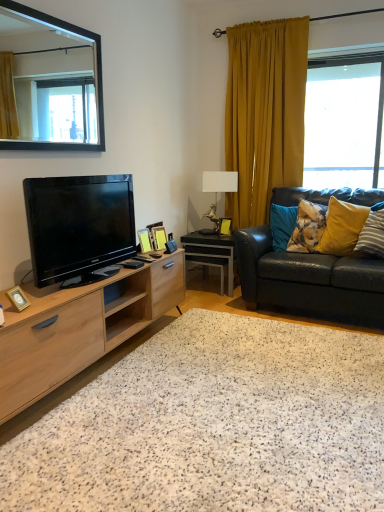
Question: From a real-world perspective, is natural wood cabinet at left below gold metallic photo frame at lower left, which appears as the first picture frame when ordered from the bottom?

Choices:
 (A) yes
 (B) no

Answer: (A)

Question: Is natural wood cabinet at left taller than gold metallic photo frame at lower left, the first picture frame when ordered from left to right?

Choices:
 (A) yes
 (B) no

Answer: (A)

Question: Is the depth of natural wood cabinet at left less than that of gold metallic photo frame at lower left, which ranks as the fourth picture frame in back-to-front order?

Choices:
 (A) yes
 (B) no

Answer: (A)

Question: Is natural wood cabinet at left bigger than gold metallic photo frame at lower left, which appears as the first picture frame when ordered from the bottom?

Choices:
 (A) yes
 (B) no

Answer: (A)

Question: Is natural wood cabinet at left positioned beyond the bounds of gold metallic photo frame at lower left, which is the fourth picture frame in top-to-bottom order?

Choices:
 (A) no
 (B) yes

Answer: (B)

Question: Is wooden picture frame at center, the third picture frame from the left, in front of or behind wooden picture frame at center, the 3th picture frame viewed from the back, in the image?

Choices:
 (A) front
 (B) behind

Answer: (B)

Question: In terms of size, does wooden picture frame at center, the third picture frame from the left, appear bigger or smaller than wooden picture frame at center, which is counted as the 3th picture frame, starting from the right?

Choices:
 (A) big
 (B) small

Answer: (A)

Question: Do you think wooden picture frame at center, arranged as the second picture frame when viewed from the right, is within wooden picture frame at center, the 2th picture frame positioned from the bottom, or outside of it?

Choices:
 (A) inside
 (B) outside

Answer: (B)

Question: In terms of height, does wooden picture frame at center, arranged as the second picture frame when viewed from the right, look taller or shorter compared to wooden picture frame at center, the 3th picture frame viewed from the back?

Choices:
 (A) short
 (B) tall

Answer: (B)

Question: Considering their positions, is gold metallic photo frame at lower left, the 4th picture frame when ordered from right to left, located in front of or behind yellow fabric pillow at right, the 1th pillow positioned from the right?

Choices:
 (A) behind
 (B) front

Answer: (B)

Question: Considering the positions of gold metallic photo frame at lower left, which ranks as the fourth picture frame in back-to-front order, and yellow fabric pillow at right, the 1th pillow positioned from the right, in the image, is gold metallic photo frame at lower left, which ranks as the fourth picture frame in back-to-front order, taller or shorter than yellow fabric pillow at right, the 1th pillow positioned from the right,?

Choices:
 (A) short
 (B) tall

Answer: (A)

Question: Is point pos(16,286) closer or farther from the camera than point pos(377,217)?

Choices:
 (A) farther
 (B) closer

Answer: (B)

Question: In terms of size, does gold metallic photo frame at lower left, which is the fourth picture frame in top-to-bottom order, appear bigger or smaller than yellow fabric pillow at right, which is the third pillow from left to right?

Choices:
 (A) big
 (B) small

Answer: (B)

Question: Considering the positions of black glossy tv at left and metallic gold lamp at center in the image, is black glossy tv at left wider or thinner than metallic gold lamp at center?

Choices:
 (A) wide
 (B) thin

Answer: (A)

Question: Considering the positions of black glossy tv at left and metallic gold lamp at center in the image, is black glossy tv at left taller or shorter than metallic gold lamp at center?

Choices:
 (A) tall
 (B) short

Answer: (B)